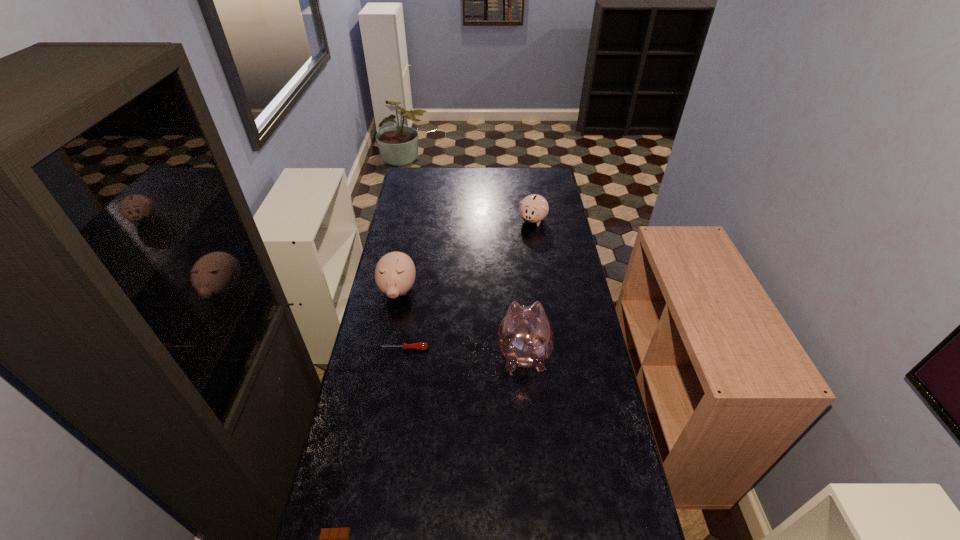
This screenshot has width=960, height=540. Identify the location of free point between the fourth shortest object and the screwdriver. (401, 320).

Where is `free spot between the screwdriver and the farthest object`? free spot between the screwdriver and the farthest object is located at coordinates (468, 285).

At what (x,y) coordinates should I click in order to perform the action: click on vacant area that lies between the second tallest piggy bank and the third shortest object. Please return your answer as a coordinate pair (x, y). The image size is (960, 540). Looking at the image, I should click on (466, 256).

Locate an element on the screen. blank region between the shortest piggy bank and the second shortest object is located at coordinates (468, 285).

You are a GUI agent. You are given a task and a screenshot of the screen. Output one action in this format:
    pyautogui.click(x=<x>, y=<y>)
    Task: Click on the free spot between the tallest object and the farthest piggy bank
    This screenshot has width=960, height=540.
    Given the screenshot: What is the action you would take?
    pyautogui.click(x=528, y=287)

I want to click on free point between the second shortest piggy bank and the screwdriver, so click(x=401, y=320).

The image size is (960, 540). What are the coordinates of `object identified as the closest to the farthest object` in the screenshot? It's located at (395, 272).

Identify which object is the fourth closest to the shortest object. Please provide its 2D coordinates. Your answer should be formatted as a tuple, i.e. [(x, y)], where the tuple contains the x and y coordinates of a point satisfying the conditions above.

[(534, 208)]

Locate an element on the screen. piggy bank identified as the second closest to the screwdriver is located at coordinates (525, 334).

Identify the location of piggy bank that is the second closest one to the third shortest object. The height and width of the screenshot is (540, 960). (525, 334).